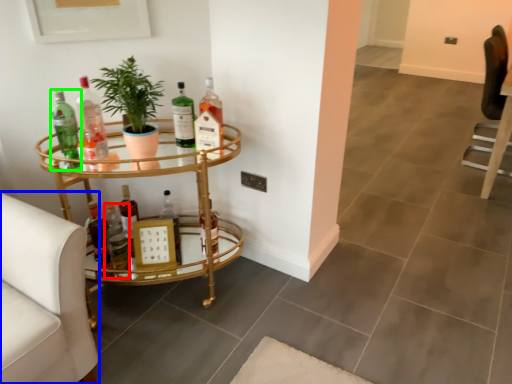
Question: Which is farther away from bottle (highlighted by a red box)? swivel chair (highlighted by a blue box) or bottle (highlighted by a green box)?

Choices:
 (A) swivel chair
 (B) bottle

Answer: (A)